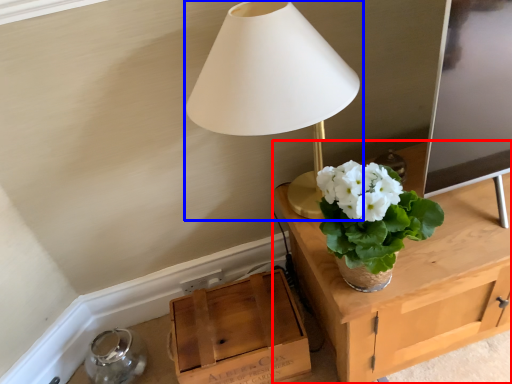
Question: Which of the following is the closest to the observer, table (highlighted by a red box) or lamp (highlighted by a blue box)?

Choices:
 (A) table
 (B) lamp

Answer: (B)